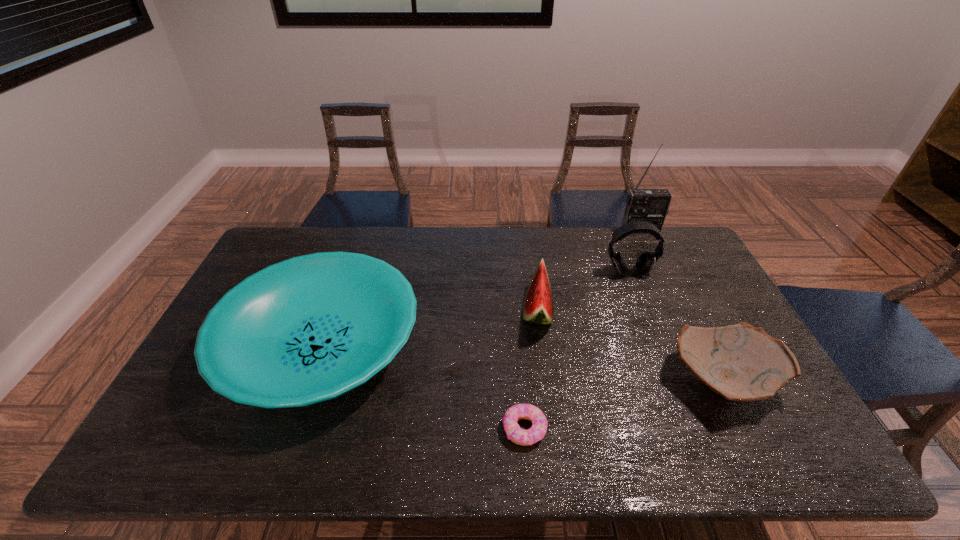
Where is `the farthest object`? The width and height of the screenshot is (960, 540). the farthest object is located at coordinates (649, 205).

This screenshot has width=960, height=540. I want to click on radio receiver, so click(x=649, y=205).

Where is `earphone`? This screenshot has width=960, height=540. earphone is located at coordinates (645, 262).

This screenshot has width=960, height=540. In order to click on the second tallest object in this screenshot , I will do `click(645, 262)`.

The width and height of the screenshot is (960, 540). What are the coordinates of `watermelon` in the screenshot? It's located at (538, 308).

You are a GUI agent. You are given a task and a screenshot of the screen. Output one action in this format:
    pyautogui.click(x=<x>, y=<y>)
    Task: Click on the leftmost object
    The image size is (960, 540).
    Given the screenshot: What is the action you would take?
    pyautogui.click(x=308, y=329)

Locate an element on the screen. The image size is (960, 540). pottery is located at coordinates (740, 362).

In order to click on doughnut in this screenshot , I will do `click(517, 435)`.

Identify the location of free space located 0.330m on the display of the farthest object. (671, 295).

Locate an element on the screen. The image size is (960, 540). blank space located 0.330m on the ear cups of the fifth shortest object is located at coordinates (662, 359).